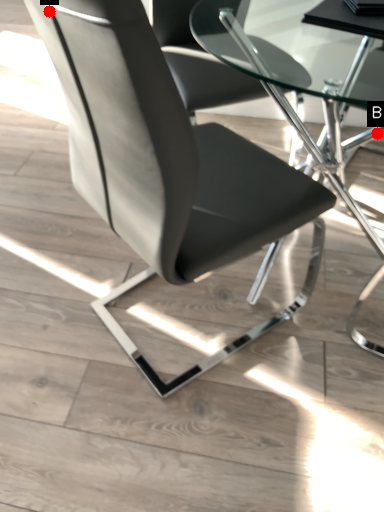
Question: Two points are circled on the image, labeled by A and B beside each circle. Which point is further to the camera?

Choices:
 (A) A is further
 (B) B is further

Answer: (B)